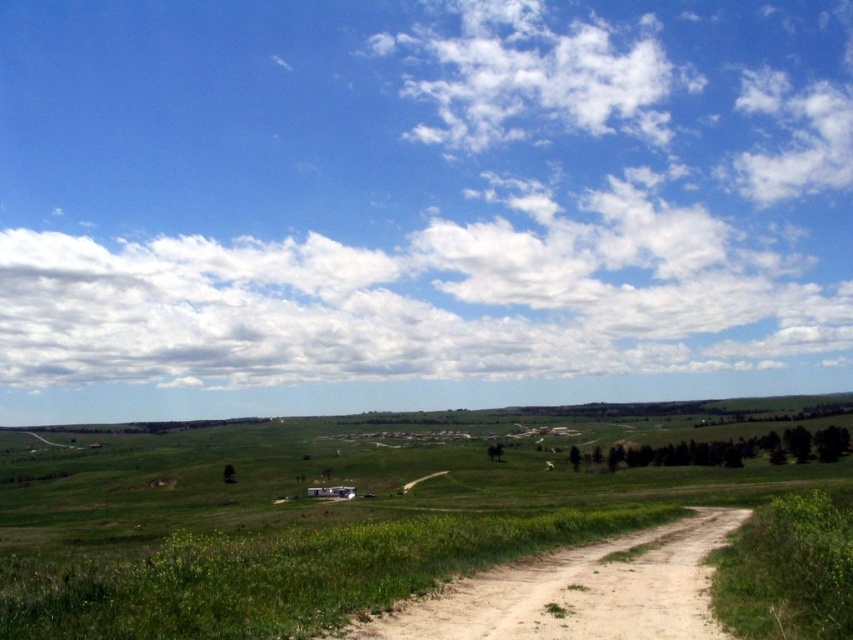
You are standing at the edge of the green grassy field at center and want to walk to the brown sandy dirt track at lower right. Which direction should you move to reach the track?

The green grassy field at center is positioned under the brown sandy dirt track at lower right, so you should move upward to reach the track.

You are standing at the origin point of the coordinate system. Where is the green grassy field at center located?

The green grassy field at center is located at point (303, 522).

You are a hiker standing at the edge of the green grassy field at center and the brown sandy dirt track at lower right. Which direction should you walk to reach the dirt track?

You should walk to the right because the brown sandy dirt track at lower right is located to the right of the green grassy field at center.